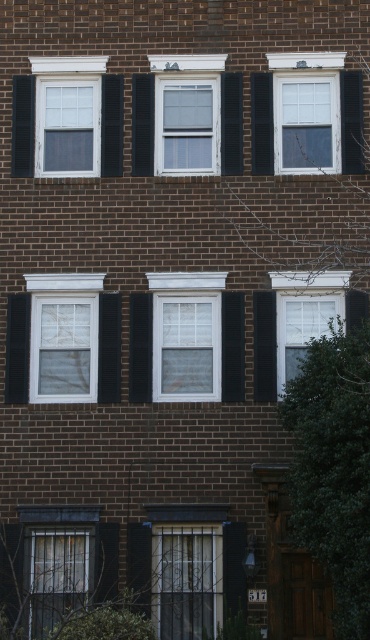
You are standing directly in front of the brick building. There is a white matte window at center located at point (186, 339). Can you tell me which direction you should move to reach the white matte window at center from your current position?

Since you are already standing directly in front of the brick building and the white matte window at center is located at point (186, 339), you are already facing the correct direction. No movement is needed to reach it.